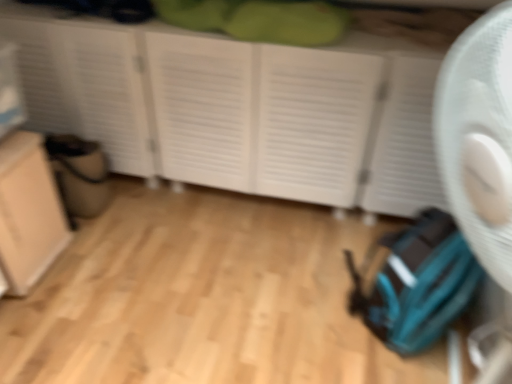
The image size is (512, 384). In order to click on empty space that is to the right of beige matte cabinet at lower left in this screenshot , I will do `click(100, 264)`.